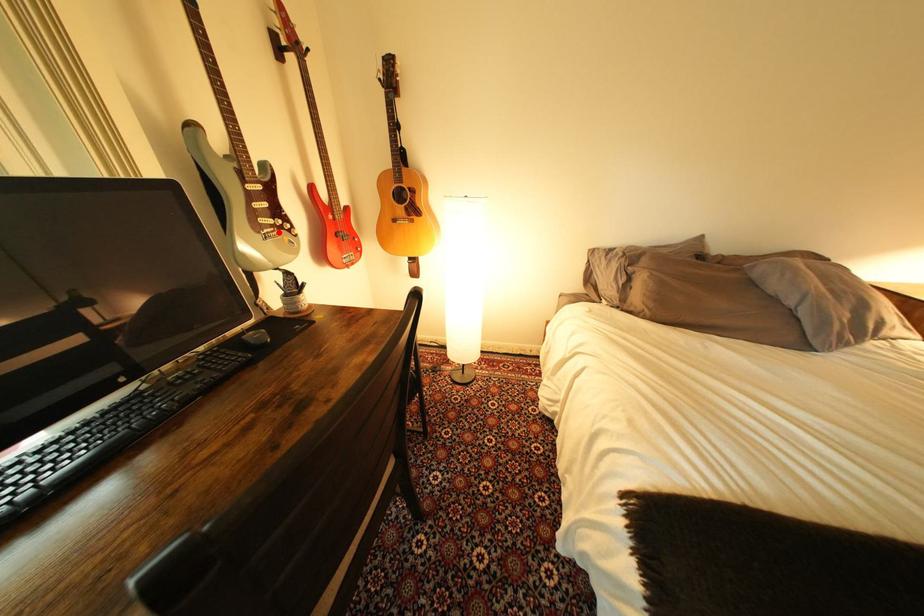
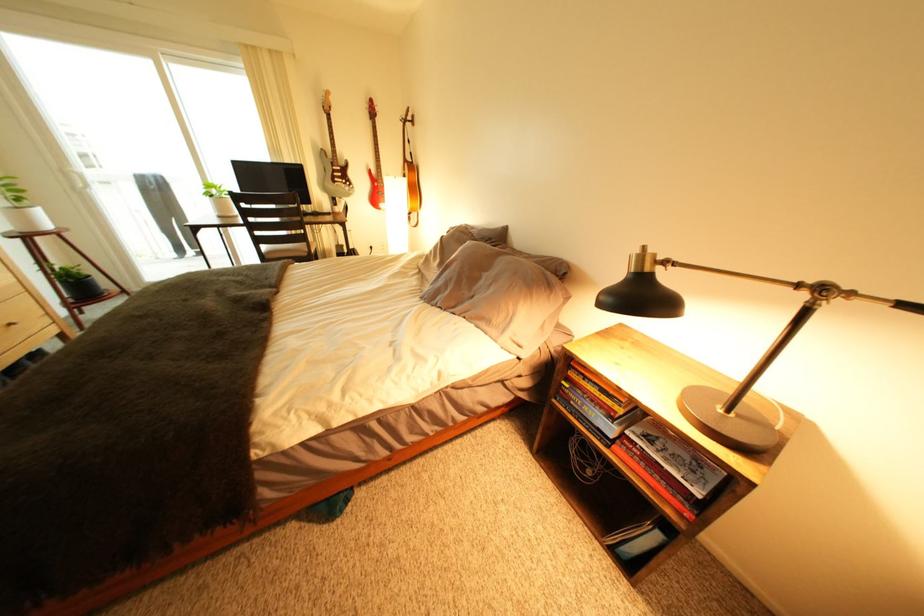
In the second image, find the point that corresponds to the highlighted location in the first image.

(349, 185)